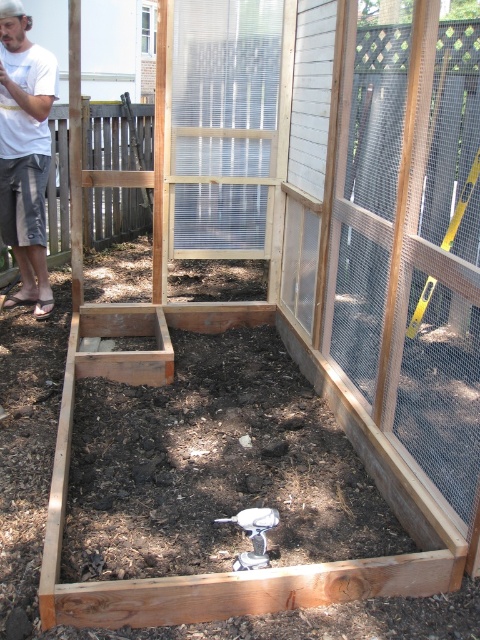
Which is more to the left, clear plastic screen door at center or white cotton shirt at upper left?

white cotton shirt at upper left

Is point (168, 250) closer to camera compared to point (7, 1)?

No, (168, 250) is further to viewer.

Between point (172, 170) and point (31, 113), which one is positioned behind?

The point (172, 170) is more distant.

Where is `clear plastic screen door at center`? clear plastic screen door at center is located at coordinates (227, 124).